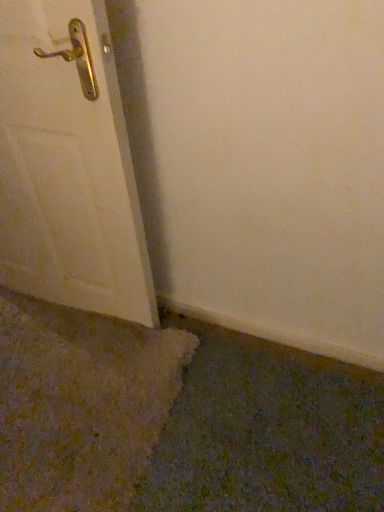
The image size is (384, 512). I want to click on white matte door at left, so click(x=68, y=164).

This screenshot has height=512, width=384. What do you see at coordinates (68, 164) in the screenshot?
I see `white matte door at left` at bounding box center [68, 164].

Where is `white matte door at left`? white matte door at left is located at coordinates (68, 164).